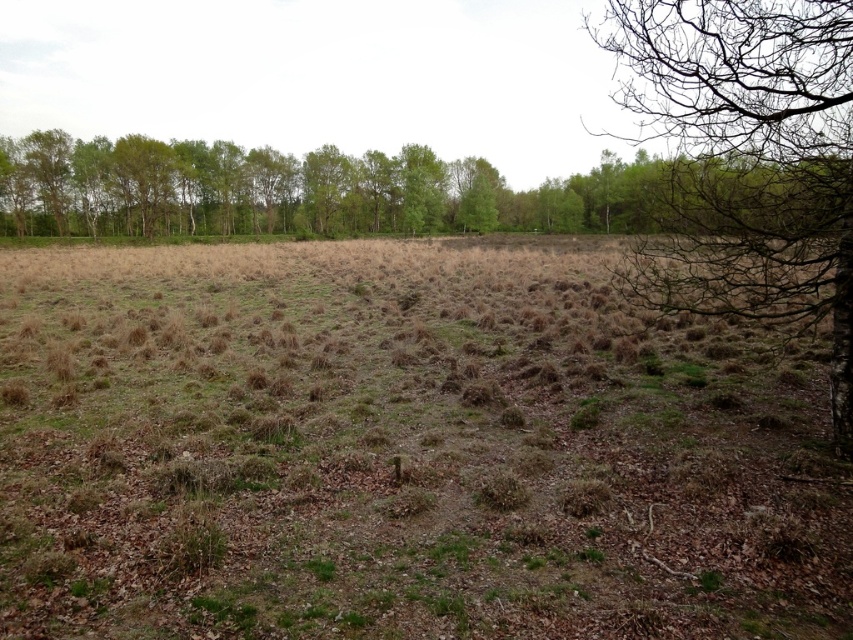
You are standing at the origin point in the center of the image. You see two points marked on the ground, point 1 at coordinates point 1 is at point (x=738, y=410) and point 2 is at point (x=403, y=228). If you want to walk to the point that is closer to the background trees, which point should you walk to?

Point 2 at coordinates point (x=403, y=228) is closer to the background trees because it is behind point 1 at coordinates point (x=738, y=410), which is in front of it.